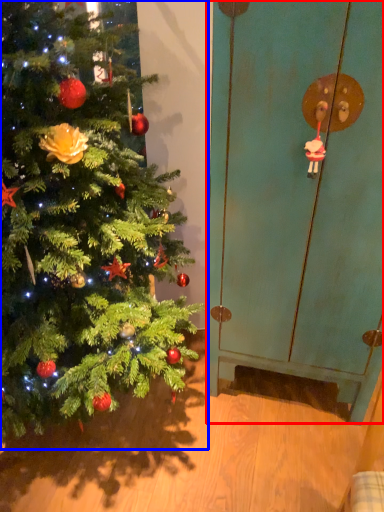
Question: Among these objects, which one is farthest to the camera, screen door (highlighted by a red box) or christmas tree (highlighted by a blue box)?

Choices:
 (A) screen door
 (B) christmas tree

Answer: (A)